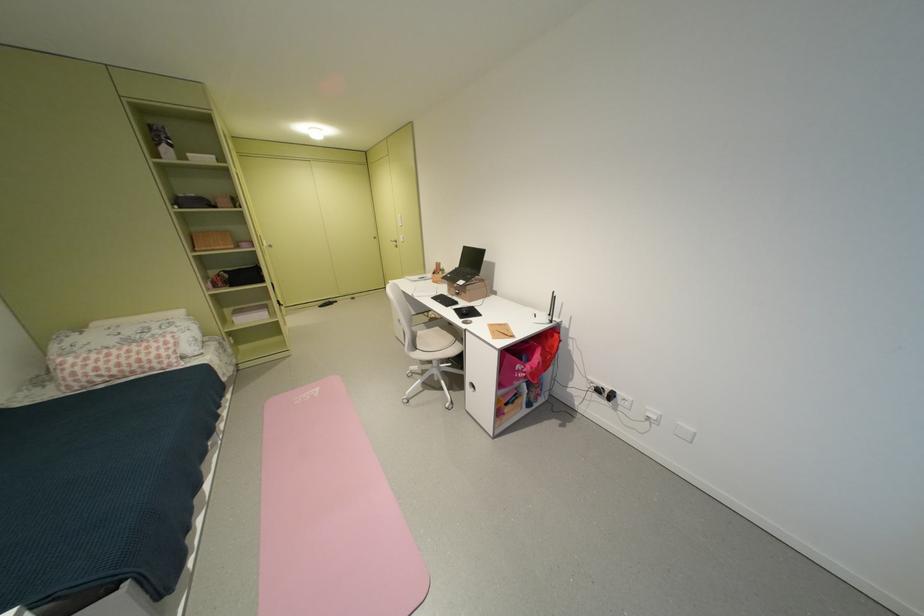
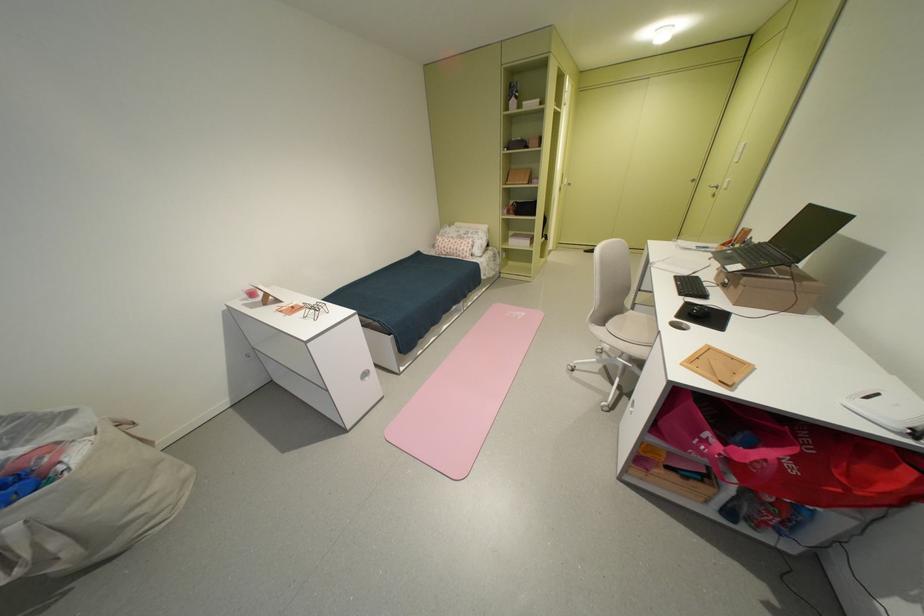
The point at (324,392) is marked in the first image. Where is the corresponding point in the second image?

(530, 315)